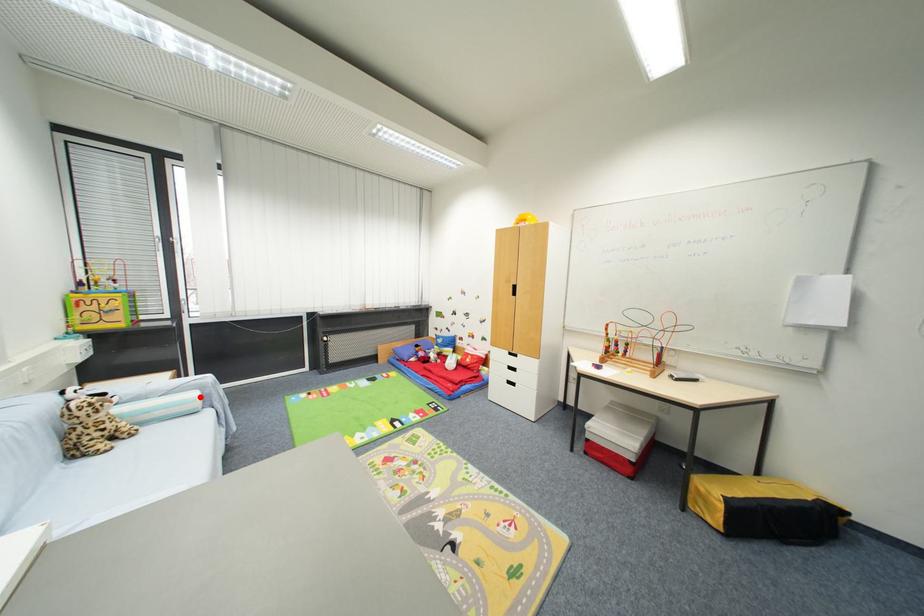
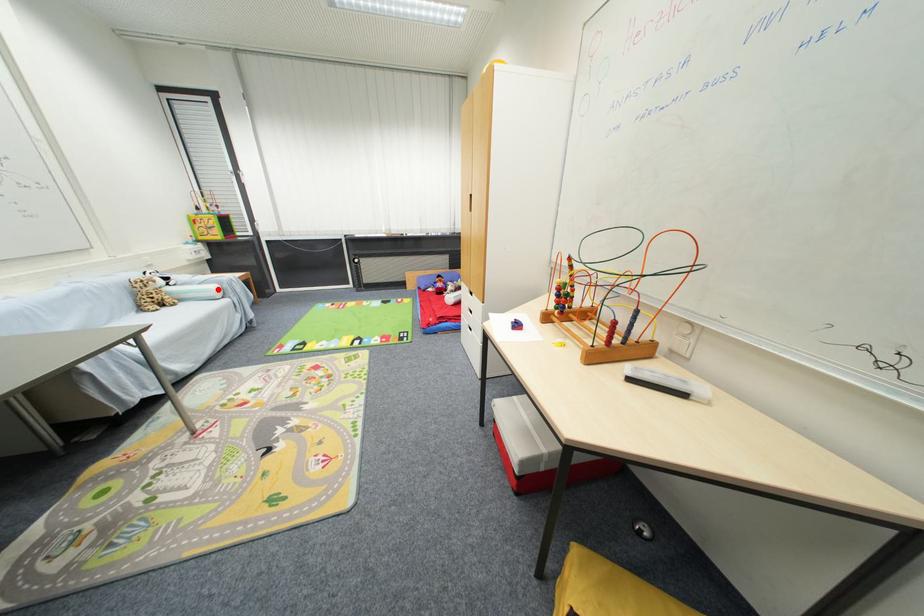
I am providing you with two images of the same scene from different viewpoints. A red point is marked on the first image and another point is marked on the second image. Is the marked point in image1 the same physical position as the marked point in image2?

Yes